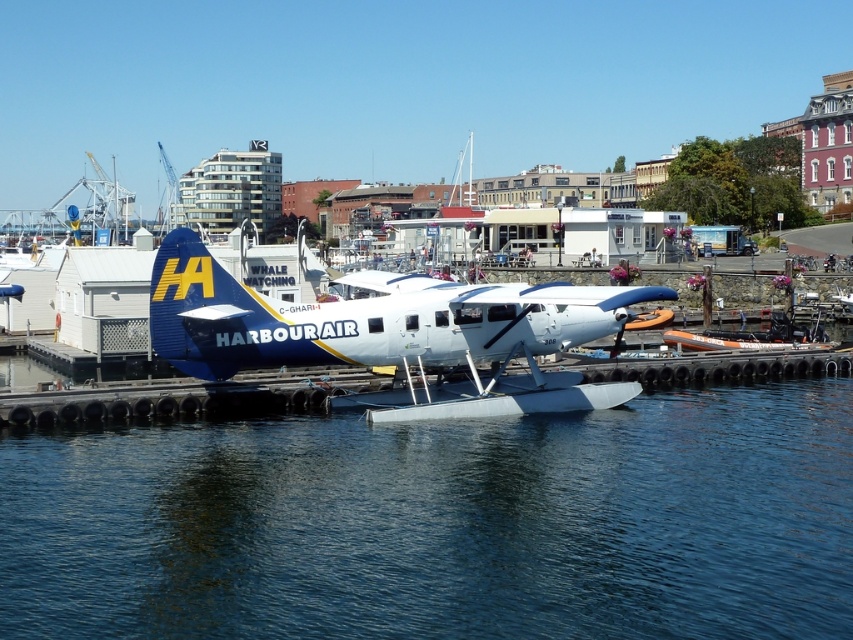
Can you confirm if blue water at center is taller than blue matte seaplane at center?

No, blue water at center is not taller than blue matte seaplane at center.

Measure the distance between blue water at center and camera.

blue water at center is 57.94 feet away from camera.

Locate an element on the screen. This screenshot has height=640, width=853. blue water at center is located at coordinates (442, 524).